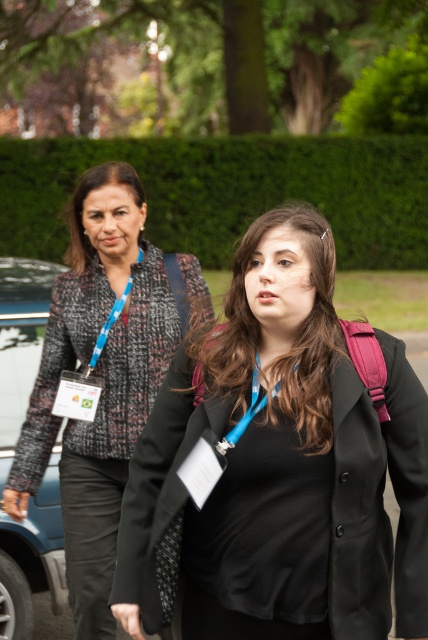
You are a fashion designer observing two people in the park. You notice the black matte blazer at center and the matte black jacket at upper left. Which clothing item is larger in size?

The black matte blazer at center is bigger than the matte black jacket at upper left.

You are a photographer trying to capture both the speckled tweed blazer at left and the matte black jacket at upper left in a single frame. Based on their positions, which one is closer to the right edge of the photo?

The speckled tweed blazer at left is to the right of the matte black jacket at upper left, so it is closer to the right edge of the photo.

You are standing in a park and see the matte black jacket at center. If you want to reach it within 3 seconds while walking at a normal pace of 1.5 meters per second, will you be able to do so?

The matte black jacket at center is 2.28 meters from viewer. Since walking at 1.5 meters per second for 3 seconds covers 4.5 meters, you can reach it in time.